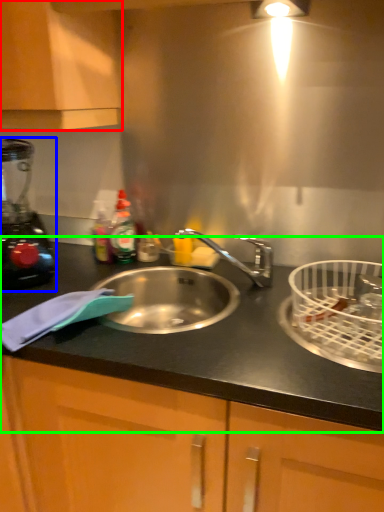
Question: Which object is the closest to the cabinetry (highlighted by a red box)? Choose among these: blender (highlighted by a blue box) or countertop (highlighted by a green box).

Choices:
 (A) blender
 (B) countertop

Answer: (A)